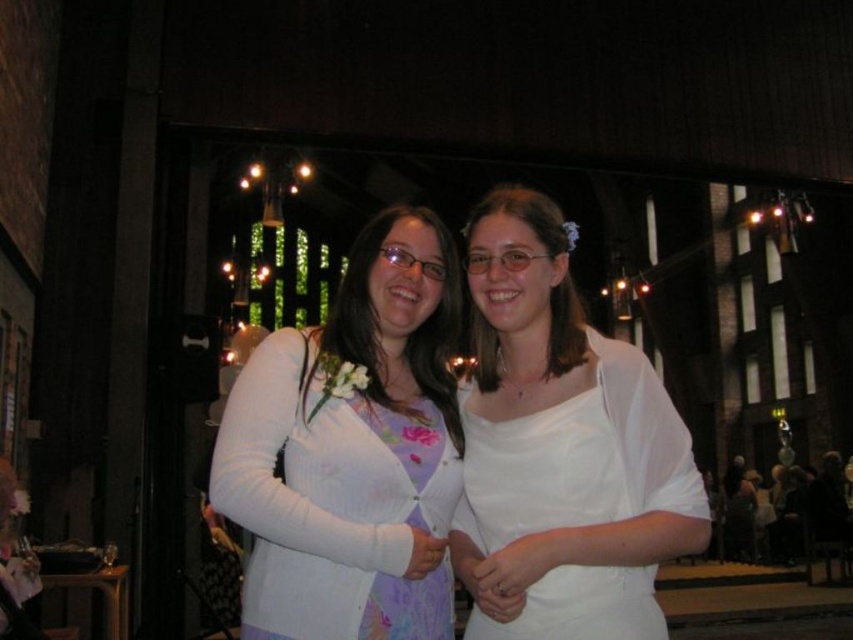
You are a photographer standing behind the two people in the image. You want to take a photo of both the white matte cardigan at center and the white satin dress at center without any overlap. Given that your camera has a maximum focus range of 3 meters, can you capture both subjects in focus at the same time?

The white matte cardigan at center is 4.03 meters from the white satin dress at center. Since the distance between them exceeds the camera maximum focus range of 3 meters, you cannot capture both subjects in focus at the same time.